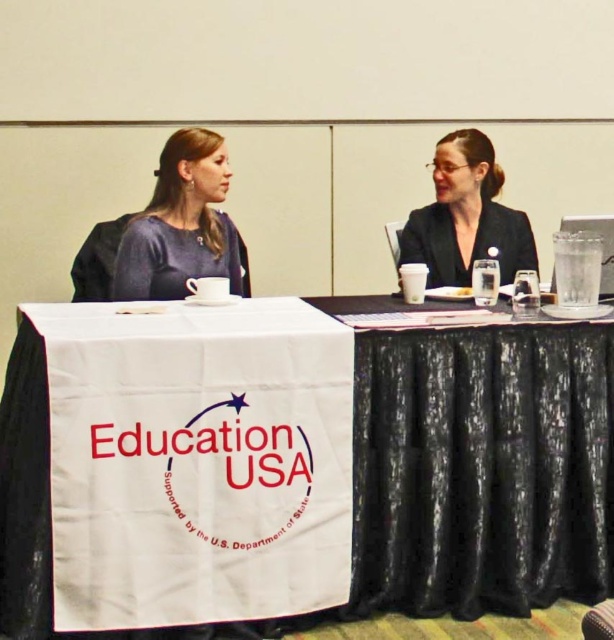
Question: Based on their relative distances, which object is nearer to the matte black blazer at center?

Choices:
 (A) matte blue dress at center
 (B) white fabric table at center

Answer: (A)

Question: Among these objects, which one is farthest from the camera?

Choices:
 (A) matte black blazer at center
 (B) white fabric table at center

Answer: (A)

Question: Does white fabric table at center appear over matte black blazer at center?

Choices:
 (A) no
 (B) yes

Answer: (A)

Question: Which object appears farthest from the camera in this image?

Choices:
 (A) matte blue dress at center
 (B) white fabric table at center

Answer: (A)

Question: Does white fabric table at center have a lesser width compared to matte black blazer at center?

Choices:
 (A) yes
 (B) no

Answer: (B)

Question: Is white fabric table at center behind matte black blazer at center?

Choices:
 (A) yes
 (B) no

Answer: (B)